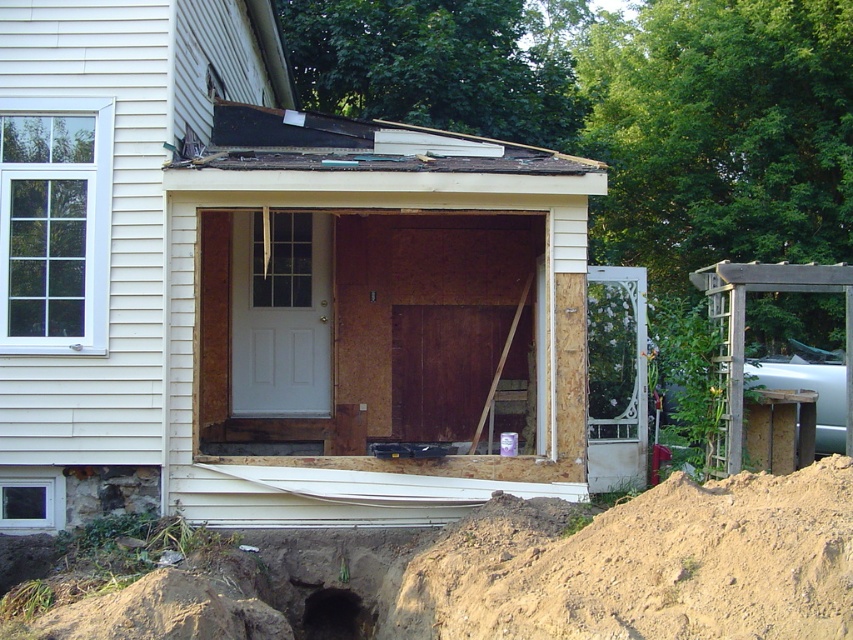
You are a construction worker standing near the door. You need to move a heavy tool from the brown dirt mound at lower right to the black dirt hole at lower center. Can you directly move it without stepping over any obstacles?

The brown dirt mound at lower right is in front of the black dirt hole at lower center, so you can directly move the tool from the brown dirt mound at lower right to the black dirt hole at lower center without needing to step over any obstacles between them.

You are standing at the construction site and see a point marked at coordinate (645, 564). Based on the scene description, where is this point located?

The point at coordinate (645, 564) is located on the brown dirt mound at lower right.